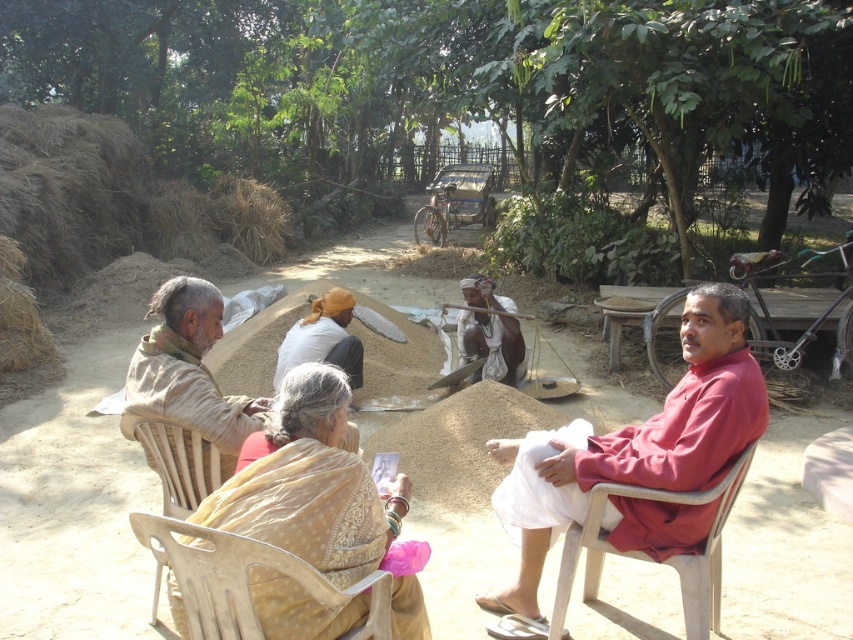
You are a photographer trying to capture a photo of the brown dirt field at center and the light beige fabric at center. Based on their positions, which object should you focus on first to ensure both are in clear view?

The brown dirt field at center is in front of the light beige fabric at center, so you should focus on the brown dirt field at center first to ensure both are in clear view.

You are planning to set up a small tent for a picnic in the brown dirt field at center and the light beige fabric at center. Which location would you choose based on the available space?

The brown dirt field at center is larger in size than the light beige fabric at center, so the tent would have more space there.